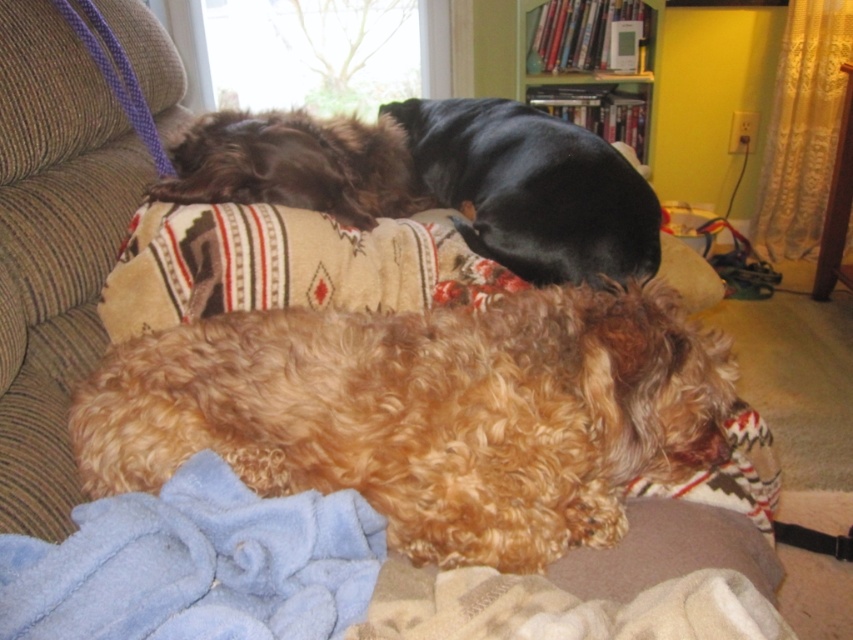
Is point (479, 378) closer to camera compared to point (553, 74)?

Yes, point (479, 378) is closer to viewer.

Between fuzzy brown dog at center and wooden bookshelf at upper center, which one appears on the right side from the viewer's perspective?

wooden bookshelf at upper center is more to the right.

I want to click on fuzzy brown dog at center, so click(x=426, y=413).

Which is below, black smooth dog at upper center or wooden bookshelf at upper center?

black smooth dog at upper center

What do you see at coordinates (532, 189) in the screenshot? I see `black smooth dog at upper center` at bounding box center [532, 189].

Find the location of `black smooth dog at upper center`. black smooth dog at upper center is located at coordinates (532, 189).

Looking at this image, how much distance is there between fuzzy brown dog at center and shaggy brown dog at upper center?

A distance of 25.22 inches exists between fuzzy brown dog at center and shaggy brown dog at upper center.

Between fuzzy brown dog at center and shaggy brown dog at upper center, which one appears on the left side from the viewer's perspective?

From the viewer's perspective, shaggy brown dog at upper center appears more on the left side.

Image resolution: width=853 pixels, height=640 pixels. What are the coordinates of `fuzzy brown dog at center` in the screenshot? It's located at (426, 413).

The width and height of the screenshot is (853, 640). I want to click on fuzzy brown dog at center, so click(x=426, y=413).